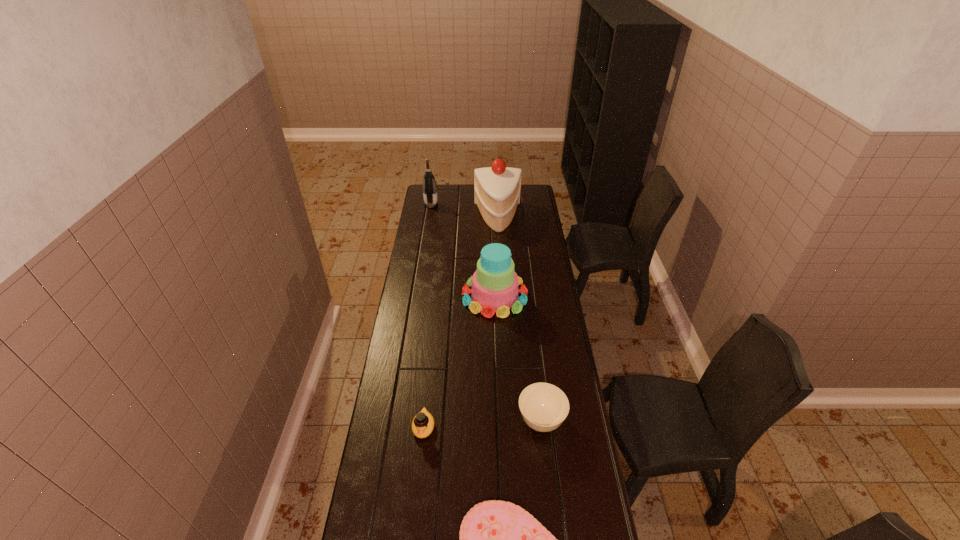
You are a GUI agent. You are given a task and a screenshot of the screen. Output one action in this format:
    pyautogui.click(x=<x>, y=<y>)
    Task: Click on the vacant point located 0.140m on the front-facing side of the fifth object from right to left
    The height and width of the screenshot is (540, 960).
    Given the screenshot: What is the action you would take?
    pyautogui.click(x=418, y=483)

At what (x,y) coordinates should I click in order to perform the action: click on cake at the far edge. Please return your answer as a coordinate pair (x, y). This screenshot has height=540, width=960. Looking at the image, I should click on (497, 189).

Image resolution: width=960 pixels, height=540 pixels. In order to click on wine bottle present at the far edge in this screenshot , I will do `click(430, 196)`.

Where is `wine bottle that is at the left edge`? The width and height of the screenshot is (960, 540). wine bottle that is at the left edge is located at coordinates (x=430, y=196).

Find the location of `duck at the left edge`. duck at the left edge is located at coordinates (423, 423).

The width and height of the screenshot is (960, 540). In order to click on sugar bowl positioned at the right edge in this screenshot , I will do `click(543, 406)`.

At what (x,y) coordinates should I click in order to perform the action: click on object at the far left corner. Please return your answer as a coordinate pair (x, y). Looking at the image, I should click on (430, 196).

The image size is (960, 540). Identify the location of object that is at the far right corner. (497, 189).

The width and height of the screenshot is (960, 540). I want to click on blank space at the far edge, so click(469, 187).

At what (x,y) coordinates should I click in order to perform the action: click on vacant area at the left edge. Please return your answer as a coordinate pair (x, y). The height and width of the screenshot is (540, 960). Looking at the image, I should click on (425, 220).